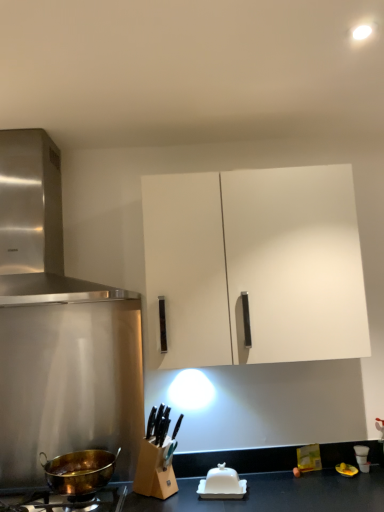
Image resolution: width=384 pixels, height=512 pixels. Describe the element at coordinates (36, 226) in the screenshot. I see `stainless steel range hood at upper left` at that location.

At what (x,y) coordinates should I click in order to perform the action: click on gold-bronze wok at lower left. Please return your answer as a coordinate pair (x, y). The image size is (384, 512). Looking at the image, I should click on (79, 471).

Measure the distance between point (181, 209) and camera.

Point (181, 209) is 1.59 meters away from camera.

Image resolution: width=384 pixels, height=512 pixels. In order to click on stainless steel range hood at upper left in this screenshot , I will do `click(36, 226)`.

Based on the photo, does white glossy butter dish at lower center touch stainless steel range hood at upper left?

No, white glossy butter dish at lower center is not in contact with stainless steel range hood at upper left.

Is white glossy butter dish at lower center smaller than stainless steel range hood at upper left?

Correct, white glossy butter dish at lower center occupies less space than stainless steel range hood at upper left.

You are a GUI agent. You are given a task and a screenshot of the screen. Output one action in this format:
    pyautogui.click(x=<x>, y=<y>)
    Task: Click on the appliance that appears behind the stainless steel range hood at upper left
    
    Given the screenshot: What is the action you would take?
    pyautogui.click(x=222, y=484)

In the scene shown: From a real-world perspective, is white glossy butter dish at lower center below stainless steel range hood at upper left?

Yes, from a real-world perspective, white glossy butter dish at lower center is below stainless steel range hood at upper left.

Is gold-bronze wok at lower left facing away from stainless steel range hood at upper left?

No, gold-bronze wok at lower left is not facing away from stainless steel range hood at upper left.

Is stainless steel range hood at upper left a part of gold-bronze wok at lower left?

That's incorrect, stainless steel range hood at upper left is not inside gold-bronze wok at lower left.

Considering the sizes of gold-bronze wok at lower left and stainless steel range hood at upper left in the image, is gold-bronze wok at lower left wider or thinner than stainless steel range hood at upper left?

In the image, gold-bronze wok at lower left appears to be more narrow than stainless steel range hood at upper left.

From the image's perspective, which is above, gold-bronze wok at lower left or stainless steel range hood at upper left?

From the image's view, stainless steel range hood at upper left is above.

Who is taller, gold-bronze wok at lower left or white matte cabinet at upper center?

Standing taller between the two is white matte cabinet at upper center.

Considering their positions, is gold-bronze wok at lower left located in front of or behind white matte cabinet at upper center?

Visually, gold-bronze wok at lower left is located in front of white matte cabinet at upper center.

Could you tell me if gold-bronze wok at lower left is turned towards white matte cabinet at upper center?

No.

Which point is more forward, (x=112, y=469) or (x=332, y=342)?

The point (x=332, y=342) is more forward.

Considering the positions of objects white matte cabinet at upper center and stainless steel range hood at upper left in the image provided, who is behind, white matte cabinet at upper center or stainless steel range hood at upper left?

white matte cabinet at upper center is further from the camera.

In terms of height, does white matte cabinet at upper center look taller or shorter compared to stainless steel range hood at upper left?

Considering their sizes, white matte cabinet at upper center has more height than stainless steel range hood at upper left.

From the image's perspective, which is above, white matte cabinet at upper center or stainless steel range hood at upper left?

From the image's view, stainless steel range hood at upper left is above.

From a real-world perspective, which object rests below the other?

white glossy butter dish at lower center, from a real-world perspective.

Consider the image. From the image's perspective, is white glossy butter dish at lower center above or below gold-bronze wok at lower left?

Clearly, from the image's perspective, white glossy butter dish at lower center is below gold-bronze wok at lower left.

In terms of height, does white glossy butter dish at lower center look taller or shorter compared to gold-bronze wok at lower left?

Considering their sizes, white glossy butter dish at lower center has less height than gold-bronze wok at lower left.

Based on the photo, does white glossy butter dish at lower center come in front of gold-bronze wok at lower left?

No, it is behind gold-bronze wok at lower left.

Measure the distance from stainless steel range hood at upper left to white matte cabinet at upper center.

stainless steel range hood at upper left and white matte cabinet at upper center are 23.21 inches apart from each other.

Which of these two, stainless steel range hood at upper left or white matte cabinet at upper center, is wider?

stainless steel range hood at upper left is wider.

Identify the location of kitchen appliance above the white matte cabinet at upper center (from a real-world perspective). (36, 226).

Considering the points (33, 152) and (158, 326), which point is behind, point (33, 152) or point (158, 326)?

The point (33, 152) is farther from the camera.

Is gold-bronze wok at lower left next to white glossy butter dish at lower center and touching it?

No, gold-bronze wok at lower left is not with white glossy butter dish at lower center.

Between gold-bronze wok at lower left and white glossy butter dish at lower center, which one has less height?

Standing shorter between the two is white glossy butter dish at lower center.

Considering the sizes of objects gold-bronze wok at lower left and white glossy butter dish at lower center in the image provided, who is wider, gold-bronze wok at lower left or white glossy butter dish at lower center?

Wider between the two is gold-bronze wok at lower left.

The height and width of the screenshot is (512, 384). Find the location of `kitchen appliance lying on the left of white glossy butter dish at lower center`. kitchen appliance lying on the left of white glossy butter dish at lower center is located at coordinates (36, 226).

Find the location of a particular element. This screenshot has width=384, height=512. kitchen appliance above the gold-bronze wok at lower left (from the image's perspective) is located at coordinates (36, 226).

Estimate the real-world distances between objects in this image. Which object is further from gold metallic pot at lower left, white matte cabinet at upper center or gold-bronze wok at lower left?

white matte cabinet at upper center.

Which object lies nearer to the anchor point gold-bronze wok at lower left, white glossy butter dish at lower center or white matte cabinet at upper center?

Among the two, white glossy butter dish at lower center is located nearer to gold-bronze wok at lower left.

Which object lies further to the anchor point white glossy butter dish at lower center, gold-bronze wok at lower left or white matte cabinet at upper center?

white matte cabinet at upper center lies further to white glossy butter dish at lower center than the other object.

Which object lies nearer to the anchor point white glossy butter dish at lower center, white matte cabinet at upper center or gold-bronze wok at lower left?

The object closer to white glossy butter dish at lower center is gold-bronze wok at lower left.

Based on their spatial positions, is gold metallic pot at lower left or gold-bronze wok at lower left closer to white matte cabinet at upper center?

gold-bronze wok at lower left is closer to white matte cabinet at upper center.

Considering their positions, is stainless steel range hood at upper left positioned further to white glossy butter dish at lower center than white matte cabinet at upper center?

stainless steel range hood at upper left lies further to white glossy butter dish at lower center than the other object.

From the image, which object appears to be farther from gold-bronze wok at lower left, white matte cabinet at upper center or gold metallic pot at lower left?

Among the two, white matte cabinet at upper center is located further to gold-bronze wok at lower left.

From the picture: Which object lies further to the anchor point gold metallic pot at lower left, stainless steel range hood at upper left or white matte cabinet at upper center?

stainless steel range hood at upper left is further to gold metallic pot at lower left.

Where is `appliance between stainless steel range hood at upper left and gold metallic pot at lower left vertically`? Image resolution: width=384 pixels, height=512 pixels. appliance between stainless steel range hood at upper left and gold metallic pot at lower left vertically is located at coordinates (222, 484).

At what (x,y) coordinates should I click in order to perform the action: click on wok between stainless steel range hood at upper left and gold metallic pot at lower left from top to bottom. Please return your answer as a coordinate pair (x, y). The height and width of the screenshot is (512, 384). Looking at the image, I should click on (79, 471).

The image size is (384, 512). Identify the location of wok situated between gold metallic pot at lower left and white glossy butter dish at lower center from left to right. (79, 471).

You are a GUI agent. You are given a task and a screenshot of the screen. Output one action in this format:
    pyautogui.click(x=<x>, y=<y>)
    Task: Click on the cabinetry between stainless steel range hood at upper left and gold-bronze wok at lower left vertically
    
    Given the screenshot: What is the action you would take?
    pyautogui.click(x=254, y=266)